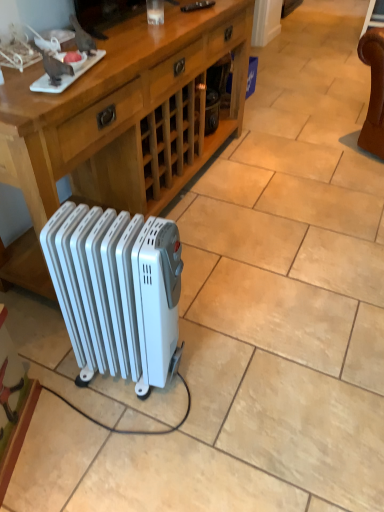
This screenshot has width=384, height=512. I want to click on vacant area that is in front of white plastic radiator at lower center, so click(127, 444).